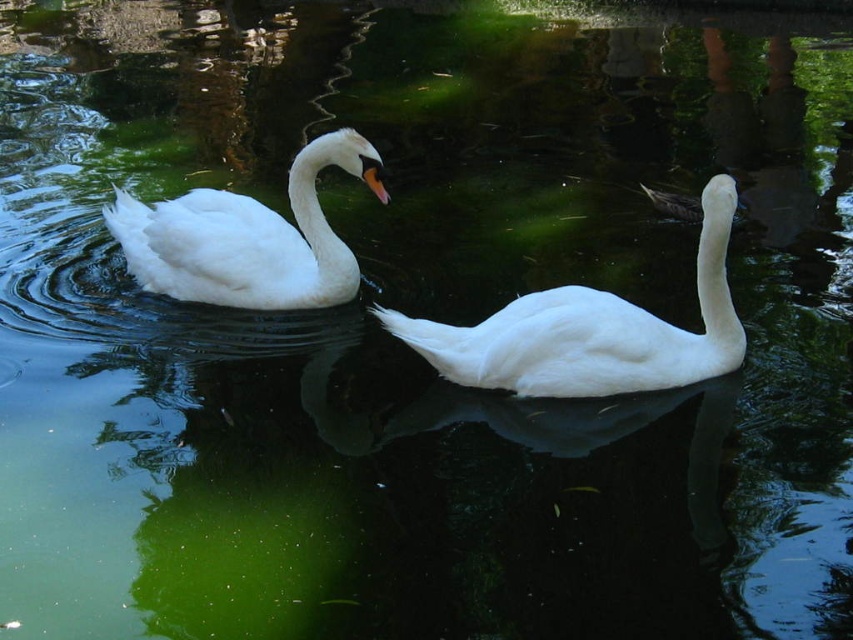
Measure the distance from white matte swan at center to white glossy swan at upper left.

white matte swan at center is 1.08 meters away from white glossy swan at upper left.

Image resolution: width=853 pixels, height=640 pixels. In order to click on white matte swan at center in this screenshot , I will do `click(592, 332)`.

Does point (665, 328) lie behind point (236, 285)?

No.

In order to click on white matte swan at center in this screenshot , I will do `click(592, 332)`.